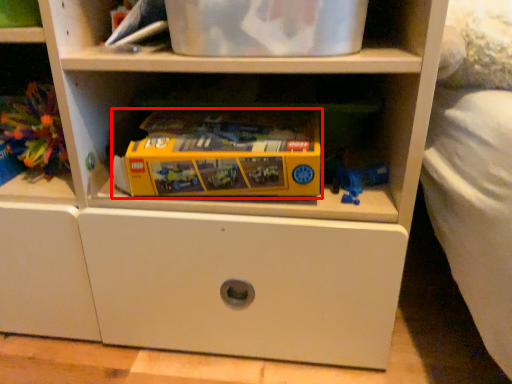
Question: In this image, where is toy (annotated by the red box) located relative to toy?

Choices:
 (A) left
 (B) right

Answer: (B)